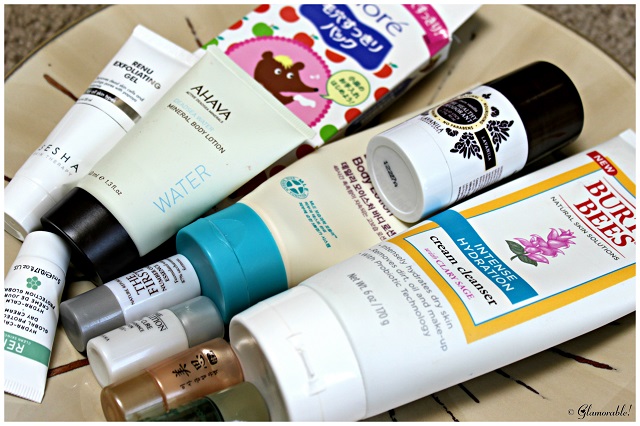
This screenshot has width=640, height=426. I want to click on small gold bottle with asian characters, so click(x=180, y=377).